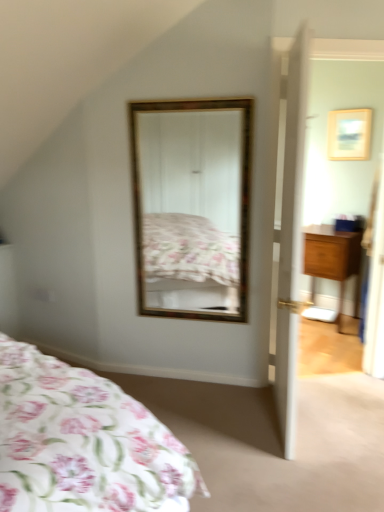
Question: Does wooden nightstand at right turn towards gold-framed mirror at center?

Choices:
 (A) yes
 (B) no

Answer: (A)

Question: From the image's perspective, is wooden nightstand at right under gold-framed mirror at center?

Choices:
 (A) yes
 (B) no

Answer: (A)

Question: From a real-world perspective, is wooden nightstand at right positioned under gold-framed mirror at center based on gravity?

Choices:
 (A) no
 (B) yes

Answer: (B)

Question: From the image's perspective, is wooden nightstand at right over gold-framed mirror at center?

Choices:
 (A) yes
 (B) no

Answer: (B)

Question: Is wooden nightstand at right not inside gold-framed mirror at center?

Choices:
 (A) no
 (B) yes

Answer: (B)

Question: Considering their positions, is gold-framed mirror at center located in front of or behind wooden nightstand at right?

Choices:
 (A) behind
 (B) front

Answer: (B)

Question: Considering the positions of point (195, 231) and point (339, 321), is point (195, 231) closer or farther from the camera than point (339, 321)?

Choices:
 (A) closer
 (B) farther

Answer: (B)

Question: Looking at their shapes, would you say gold-framed mirror at center is wider or thinner than wooden nightstand at right?

Choices:
 (A) thin
 (B) wide

Answer: (A)

Question: Visually, is gold-framed mirror at center positioned to the left or to the right of wooden nightstand at right?

Choices:
 (A) right
 (B) left

Answer: (B)

Question: Looking at the image, does wooden nightstand at right seem bigger or smaller compared to wooden picture frame at upper right?

Choices:
 (A) big
 (B) small

Answer: (A)

Question: Considering their positions, is wooden nightstand at right located in front of or behind wooden picture frame at upper right?

Choices:
 (A) front
 (B) behind

Answer: (A)

Question: From the image's perspective, relative to wooden picture frame at upper right, is wooden nightstand at right above or below?

Choices:
 (A) below
 (B) above

Answer: (A)

Question: Is point (355, 309) positioned closer to the camera than point (347, 141)?

Choices:
 (A) farther
 (B) closer

Answer: (B)

Question: In the image, is white wooden door at right positioned in front of or behind gold-framed mirror at center?

Choices:
 (A) behind
 (B) front

Answer: (B)

Question: From a real-world perspective, is white wooden door at right above or below gold-framed mirror at center?

Choices:
 (A) above
 (B) below

Answer: (B)